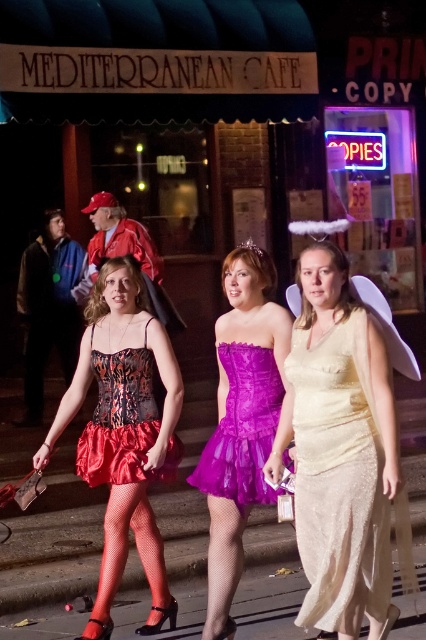
Question: Is purple satin dress at center smaller than shiny satin corset at center?

Choices:
 (A) no
 (B) yes

Answer: (B)

Question: Can you confirm if shiny gold dress at center is thinner than purple tulle dress at center?

Choices:
 (A) no
 (B) yes

Answer: (A)

Question: Based on their relative distances, which object is farther from the shiny satin corset at center?

Choices:
 (A) shiny gold dress at center
 (B) shiny red satin skirt at center
 (C) purple tulle dress at center
 (D) purple satin dress at center

Answer: (A)

Question: Considering the relative positions of shiny red satin skirt at center and smooth concrete pavement at center in the image provided, where is shiny red satin skirt at center located with respect to smooth concrete pavement at center?

Choices:
 (A) right
 (B) left

Answer: (B)

Question: Which point is closer to the camera?

Choices:
 (A) (267, 500)
 (B) (388, 400)

Answer: (B)

Question: Which object is the farthest from the smooth concrete pavement at center?

Choices:
 (A) shiny satin corset at center
 (B) purple satin dress at center
 (C) purple tulle dress at center
 (D) shiny gold dress at center

Answer: (A)